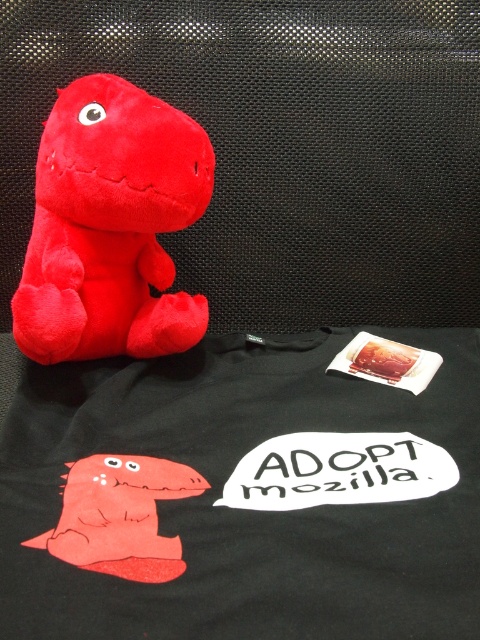
Between matte plush dinosaur at center and matte plush dinosaur at upper left, which one has less height?

With less height is matte plush dinosaur at upper left.

Can you confirm if matte plush dinosaur at center is wider than matte plush dinosaur at upper left?

Yes, matte plush dinosaur at center is wider than matte plush dinosaur at upper left.

Identify the location of matte plush dinosaur at center. (110, 225).

Locate an element on the screen. The image size is (480, 640). black cotton t-shirt at upper center is located at coordinates (243, 493).

Does black cotton t-shirt at upper center have a lesser height compared to matte plush dinosaur at upper left?

In fact, black cotton t-shirt at upper center may be taller than matte plush dinosaur at upper left.

Where is `black cotton t-shirt at upper center`? This screenshot has width=480, height=640. black cotton t-shirt at upper center is located at coordinates (243, 493).

This screenshot has height=640, width=480. I want to click on black cotton t-shirt at upper center, so click(243, 493).

In the scene shown: Is black cotton t-shirt at upper center taller than matte plush dinosaur at center?

No, black cotton t-shirt at upper center is not taller than matte plush dinosaur at center.

Can you confirm if black cotton t-shirt at upper center is shorter than matte plush dinosaur at center?

Yes.

Is point (446, 552) positioned before point (180, 131)?

Yes, it is.

Identify the location of black cotton t-shirt at upper center. The image size is (480, 640). (243, 493).